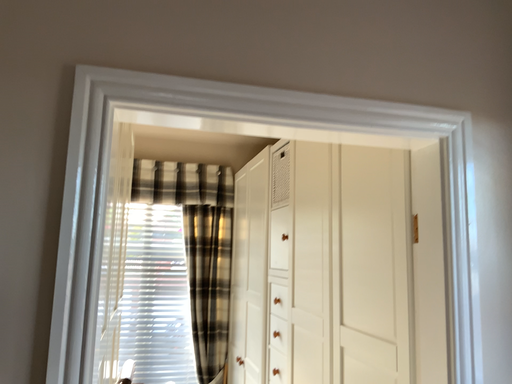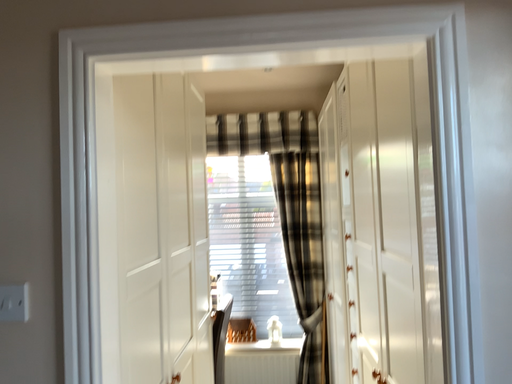
Question: How did the camera likely rotate when shooting the video?

Choices:
 (A) rotated right
 (B) rotated left

Answer: (B)